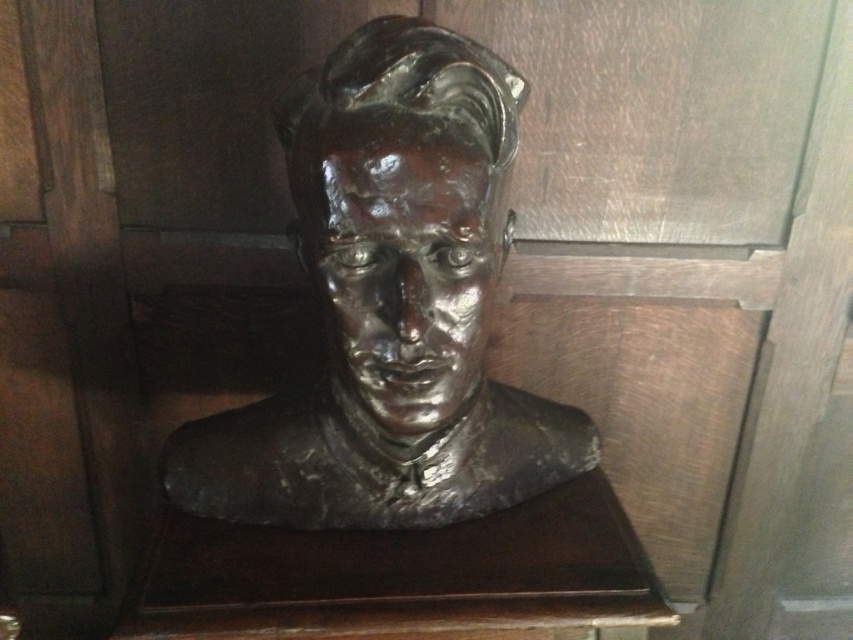
Between shiny bronze bust at center and bronze bust at center, which one appears on the left side from the viewer's perspective?

Positioned to the left is shiny bronze bust at center.

Is point (299, 141) farther from camera compared to point (347, 298)?

Yes, point (299, 141) is behind point (347, 298).

Where is `shiny bronze bust at center`? Image resolution: width=853 pixels, height=640 pixels. shiny bronze bust at center is located at coordinates (392, 307).